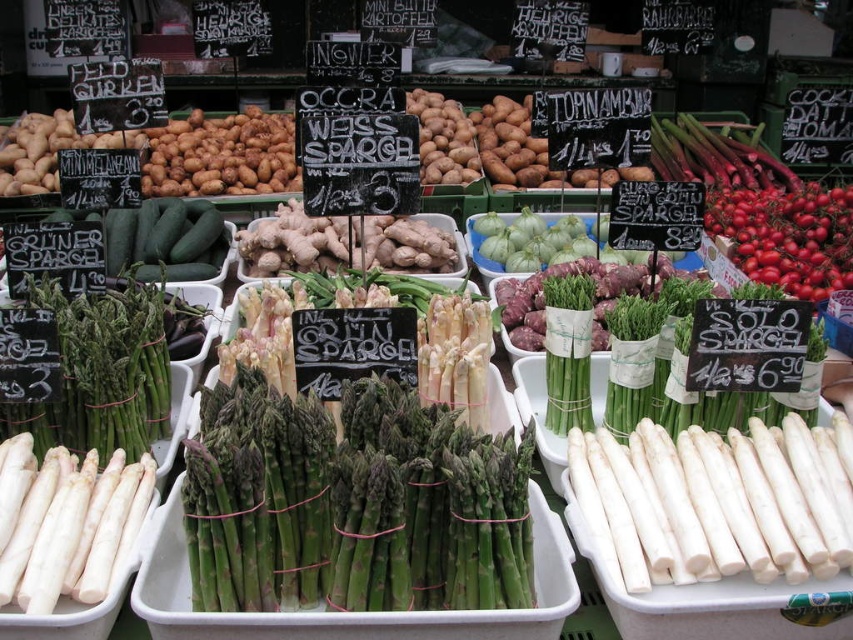
Question: Which point is farther to the camera?

Choices:
 (A) (769, 448)
 (B) (215, 397)
 (C) (845, 227)

Answer: (C)

Question: Can you confirm if white smooth asparagus at center is positioned to the left of ripe red tomatoes at upper right?

Choices:
 (A) yes
 (B) no

Answer: (A)

Question: Does green matte asparagus at center appear on the left side of white smooth asparagus at center?

Choices:
 (A) no
 (B) yes

Answer: (B)

Question: Which point is farther to the camera?

Choices:
 (A) (786, 243)
 (B) (363, 532)
 (C) (656, 508)

Answer: (A)

Question: Observing the image, what is the correct spatial positioning of green matte asparagus at center in reference to white smooth asparagus at center?

Choices:
 (A) left
 (B) right

Answer: (A)

Question: Which object is positioned closest to the ripe red tomatoes at upper right?

Choices:
 (A) white smooth asparagus at center
 (B) green matte asparagus at center

Answer: (A)